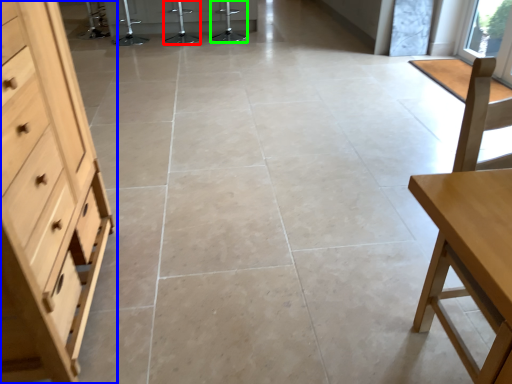
Question: Which object is the farthest from bar stool (highlighted by a red box)? Choose among these: chest of drawers (highlighted by a blue box) or bar stool (highlighted by a green box).

Choices:
 (A) chest of drawers
 (B) bar stool

Answer: (A)